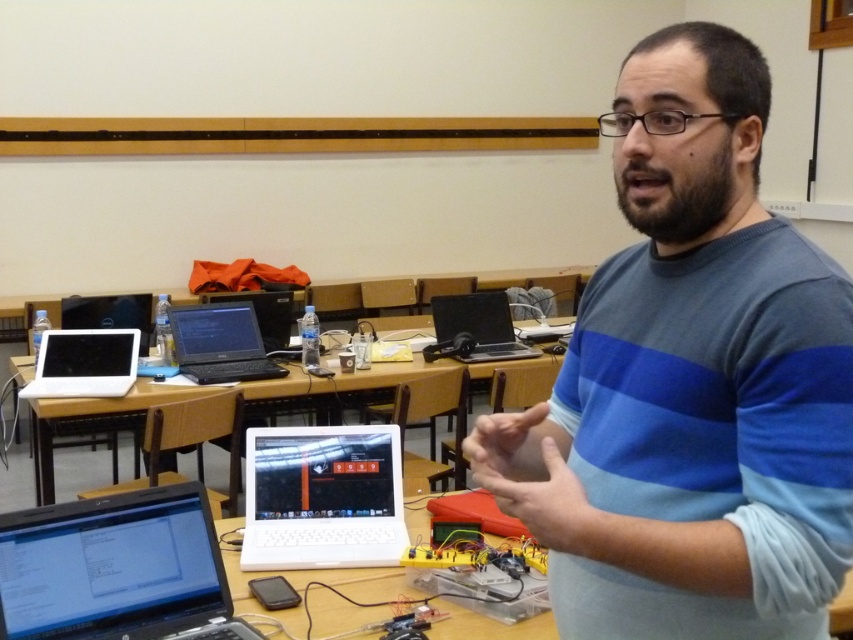
Question: Does blue striped sweater at center lie in front of silver metallic laptop at lower left?

Choices:
 (A) yes
 (B) no

Answer: (A)

Question: Among these points, which one is nearest to the camera?

Choices:
 (A) (115, 384)
 (B) (181, 605)
 (C) (267, 448)
 (D) (236, 353)

Answer: (B)

Question: Based on their relative distances, which object is nearer to the silver metallic laptop at lower left?

Choices:
 (A) blue striped sweater at center
 (B) black glossy laptop at center
 (C) black matte laptop at center

Answer: (A)

Question: Can you confirm if white plastic laptop at center is bigger than black matte laptop at center?

Choices:
 (A) no
 (B) yes

Answer: (A)

Question: Which point appears farthest from the camera in this image?

Choices:
 (A) (294, 536)
 (B) (105, 534)
 (C) (457, 348)

Answer: (C)

Question: Is blue striped sweater at center positioned before black glossy laptop at center?

Choices:
 (A) no
 (B) yes

Answer: (B)